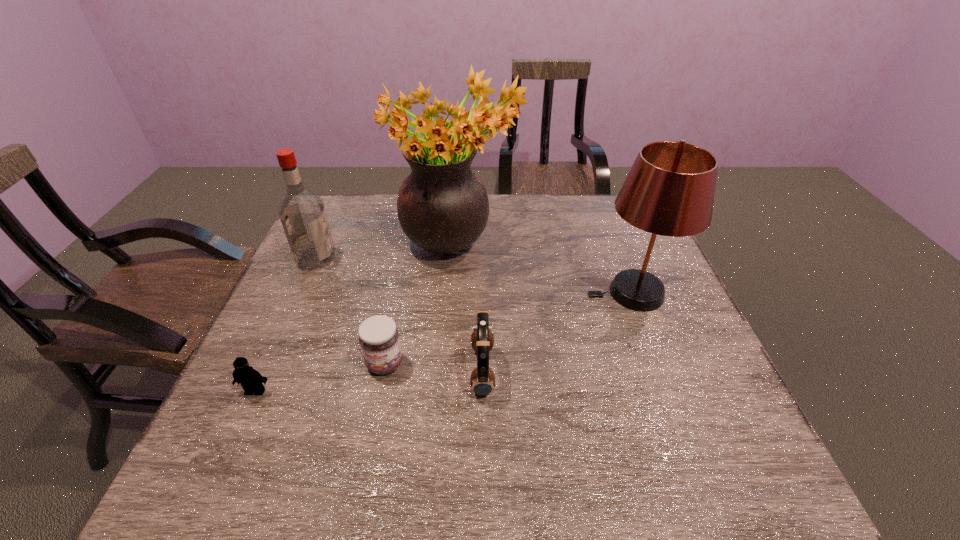
Find the location of a particular element. The width and height of the screenshot is (960, 540). free space located 0.060m on the front-facing side of the liquor is located at coordinates (355, 259).

Locate an element on the screen. vacant space located 0.380m on the ear cup of the headset is located at coordinates (297, 371).

Identify the location of free space located on the ear cup of the headset. This screenshot has height=540, width=960. (425, 371).

The image size is (960, 540). Find the location of `blank area located 0.280m on the ear cup of the headset`. blank area located 0.280m on the ear cup of the headset is located at coordinates (343, 371).

What are the coordinates of `vacant space situated 0.090m on the front label of the jam` in the screenshot? It's located at point(374,416).

At what (x,y) coordinates should I click in order to perform the action: click on vacant space situated 0.050m on the face of the Lego. Please return your answer as a coordinate pair (x, y). The width and height of the screenshot is (960, 540). Looking at the image, I should click on (243, 418).

You are a GUI agent. You are given a task and a screenshot of the screen. Output one action in this format:
    pyautogui.click(x=<x>, y=<y>)
    Task: Click on the object that is at the far edge
    The width and height of the screenshot is (960, 540).
    Given the screenshot: What is the action you would take?
    pyautogui.click(x=442, y=206)

This screenshot has height=540, width=960. What are the coordinates of `liquor that is at the left edge` in the screenshot? It's located at (302, 213).

Where is `Lego at the left edge`? The width and height of the screenshot is (960, 540). Lego at the left edge is located at coordinates (251, 380).

You are a GUI agent. You are given a task and a screenshot of the screen. Output one action in this format:
    pyautogui.click(x=<x>, y=<y>)
    Task: Click on the object that is at the right edge
    This screenshot has height=540, width=960.
    Given the screenshot: What is the action you would take?
    pyautogui.click(x=669, y=191)